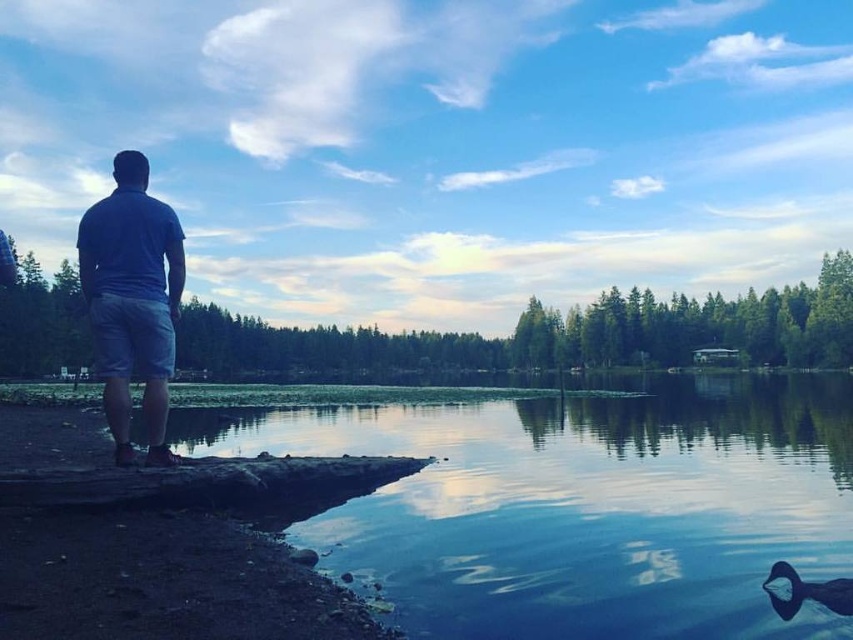
Question: Which point is closer to the camera taking this photo?

Choices:
 (A) (112, 237)
 (B) (846, 609)

Answer: (B)

Question: Is blue cotton shirt at left behind blue glossy duck at lower right?

Choices:
 (A) no
 (B) yes

Answer: (B)

Question: Where is blue cotton shirt at left located in relation to blue glossy duck at lower right in the image?

Choices:
 (A) right
 (B) left

Answer: (B)

Question: Where is blue cotton shirt at left located in relation to blue glossy duck at lower right in the image?

Choices:
 (A) right
 (B) left

Answer: (B)